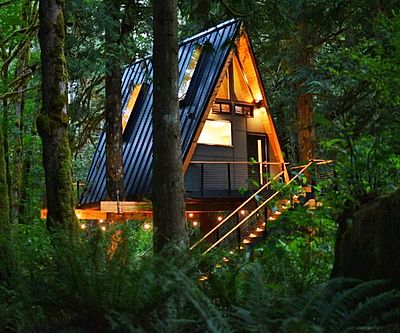
Where is `smaller windows`? The height and width of the screenshot is (333, 400). smaller windows is located at coordinates (238, 109), (220, 110).